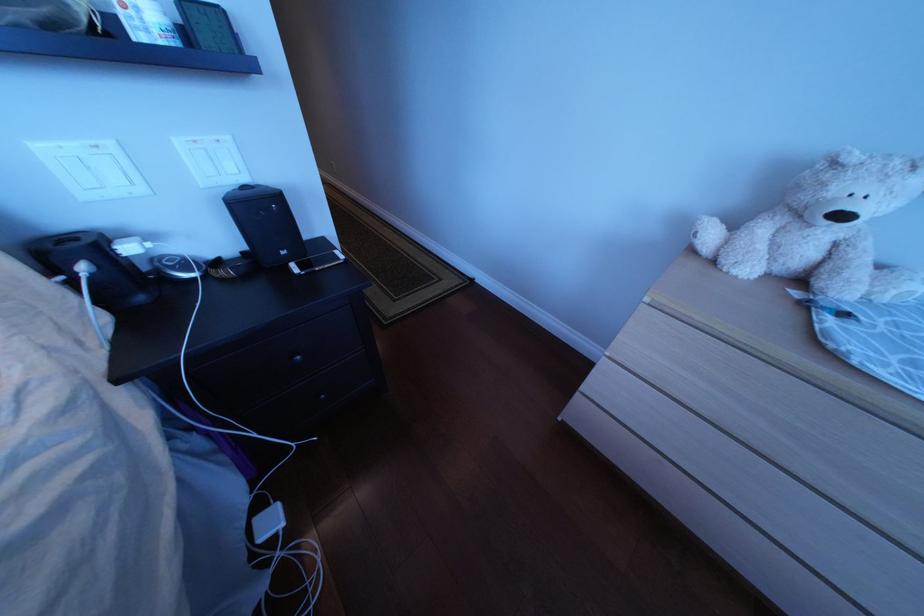
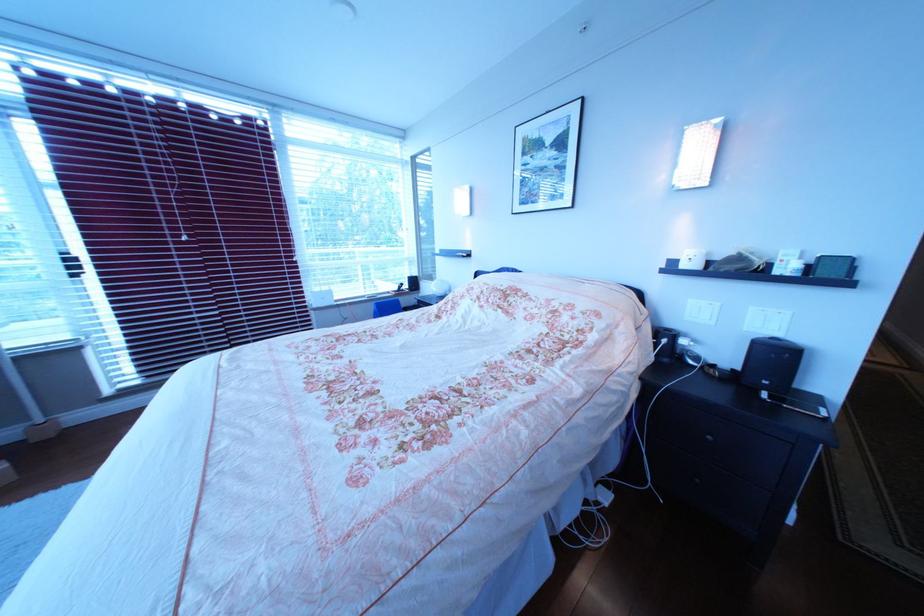
Locate, in the second image, the point that corresponds to (311,360) in the first image.

(725, 440)